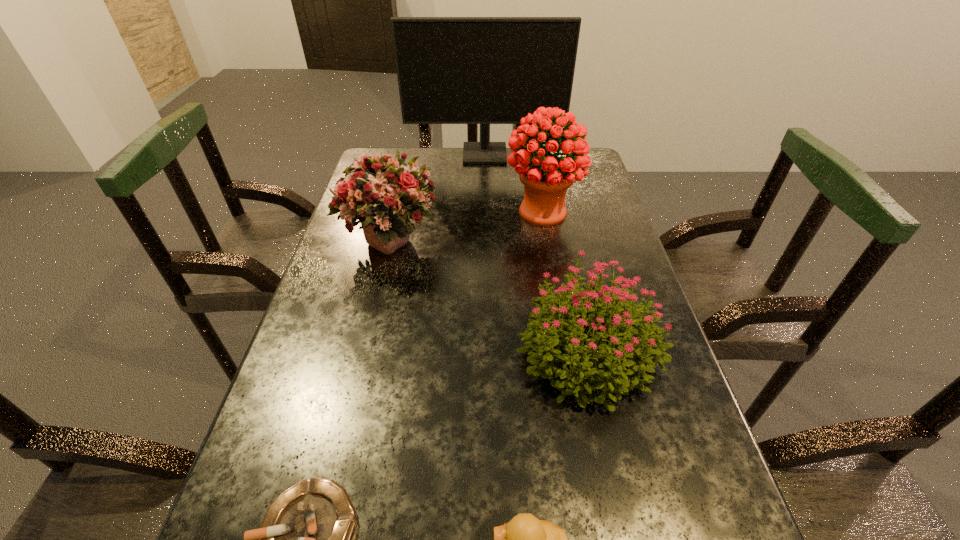
Where is `computer monitor positioned at the left edge`? Image resolution: width=960 pixels, height=540 pixels. computer monitor positioned at the left edge is located at coordinates (451, 70).

Locate an element on the screen. Image resolution: width=960 pixels, height=540 pixels. bouquet at the left edge is located at coordinates (383, 194).

In order to click on computer monitor at the right edge in this screenshot , I will do `click(451, 70)`.

Where is `object located in the far left corner section of the desktop`? The image size is (960, 540). object located in the far left corner section of the desktop is located at coordinates (451, 70).

Identify the location of object that is positioned at the far right corner. (451, 70).

This screenshot has height=540, width=960. Find the location of `vacant region at the far edge of the desktop`. vacant region at the far edge of the desktop is located at coordinates (430, 161).

Locate an element on the screen. Image resolution: width=960 pixels, height=540 pixels. vacant space at the left edge of the desktop is located at coordinates click(349, 303).

What are the coordinates of `vacant region at the right edge of the desktop` in the screenshot? It's located at (672, 395).

Find the location of `vacant space in between the tallest object and the tallest bouquet`. vacant space in between the tallest object and the tallest bouquet is located at coordinates (514, 184).

I want to click on free space between the leftmost bouquet and the tallest bouquet, so click(x=466, y=226).